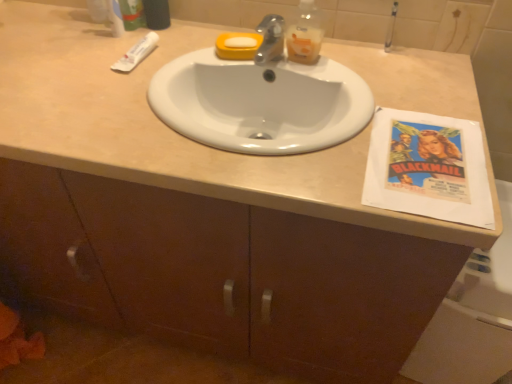
Question: Can you confirm if white matte tube at upper left is smaller than green matte toothpaste tube at upper left?

Choices:
 (A) no
 (B) yes

Answer: (B)

Question: Considering the relative positions of white matte tube at upper left and green matte toothpaste tube at upper left in the image provided, is white matte tube at upper left to the right of green matte toothpaste tube at upper left from the viewer's perspective?

Choices:
 (A) no
 (B) yes

Answer: (B)

Question: From a real-world perspective, is white matte tube at upper left physically above green matte toothpaste tube at upper left?

Choices:
 (A) yes
 (B) no

Answer: (B)

Question: Is white matte tube at upper left behind green matte toothpaste tube at upper left?

Choices:
 (A) no
 (B) yes

Answer: (A)

Question: From the image's perspective, is white matte tube at upper left on top of green matte toothpaste tube at upper left?

Choices:
 (A) yes
 (B) no

Answer: (B)

Question: From a real-world perspective, is green matte toothpaste tube at upper left positioned above or below white matte tube at upper left?

Choices:
 (A) below
 (B) above

Answer: (B)

Question: Considering the positions of green matte toothpaste tube at upper left and white matte tube at upper left in the image, is green matte toothpaste tube at upper left taller or shorter than white matte tube at upper left?

Choices:
 (A) tall
 (B) short

Answer: (A)

Question: In terms of width, does green matte toothpaste tube at upper left look wider or thinner when compared to white matte tube at upper left?

Choices:
 (A) wide
 (B) thin

Answer: (B)

Question: Is green matte toothpaste tube at upper left in front of or behind white matte tube at upper left in the image?

Choices:
 (A) behind
 (B) front

Answer: (A)

Question: Would you say translucent plastic bottle at upper center is to the left or to the right of white paper at right in the picture?

Choices:
 (A) right
 (B) left

Answer: (B)

Question: From a real-world perspective, is translucent plastic bottle at upper center physically located above or below white paper at right?

Choices:
 (A) below
 (B) above

Answer: (B)

Question: From the image's perspective, is translucent plastic bottle at upper center positioned above or below white paper at right?

Choices:
 (A) below
 (B) above

Answer: (B)

Question: Is translucent plastic bottle at upper center taller or shorter than white paper at right?

Choices:
 (A) tall
 (B) short

Answer: (B)

Question: Considering their positions, is white matte tube at upper left located in front of or behind translucent plastic bottle at upper center?

Choices:
 (A) behind
 (B) front

Answer: (A)

Question: Is white matte tube at upper left spatially inside translucent plastic bottle at upper center, or outside of it?

Choices:
 (A) inside
 (B) outside

Answer: (B)